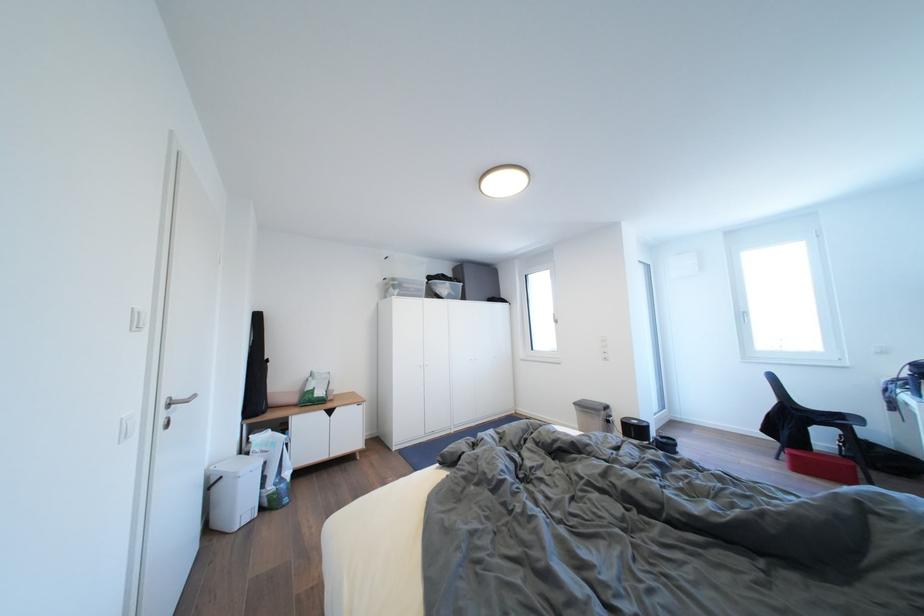
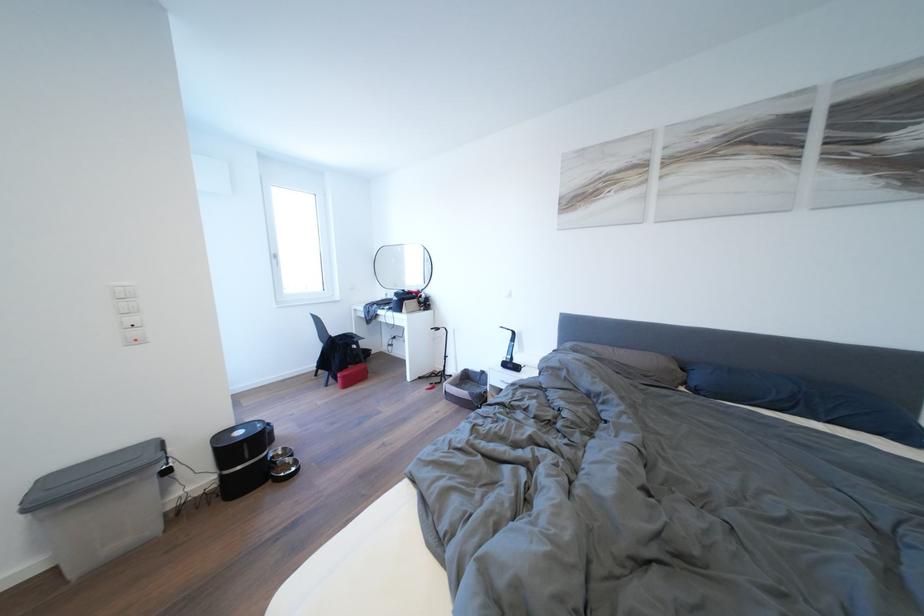
Where in the second image is the point corresponding to [642,427] from the first image?

(248, 438)